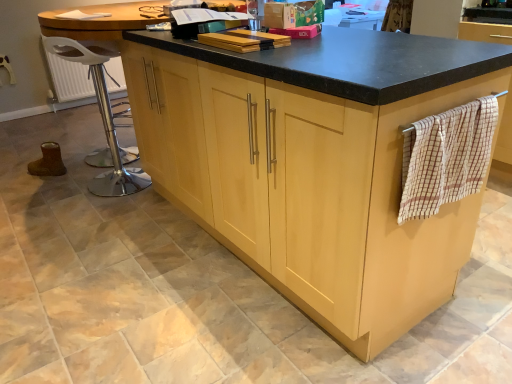
Question: Is beige checkered towel at right taller or shorter than metallic silver bar stool at left?

Choices:
 (A) short
 (B) tall

Answer: (A)

Question: Is point (483, 130) closer or farther from the camera than point (113, 175)?

Choices:
 (A) closer
 (B) farther

Answer: (A)

Question: Based on their relative distances, which object is nearer to the beige checkered towel at right?

Choices:
 (A) metallic silver bar stool at left
 (B) light wood cabinetry at center

Answer: (B)

Question: Estimate the real-world distances between objects in this image. Which object is farther from the light wood cabinetry at center?

Choices:
 (A) beige checkered towel at right
 (B) metallic silver bar stool at left

Answer: (B)